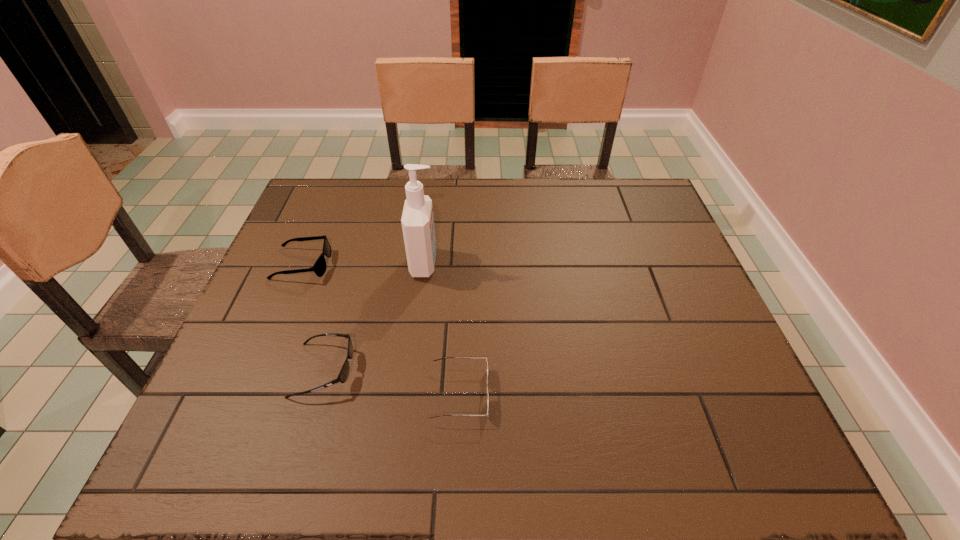
Identify which sunglasses is the second closest to the rightmost object. Please provide its 2D coordinates. Your answer should be formatted as a tuple, i.e. [(x, y)], where the tuple contains the x and y coordinates of a point satisfying the conditions above.

[(319, 268)]

Where is `sunglasses that is the nearest to the leftmost sunglasses`? sunglasses that is the nearest to the leftmost sunglasses is located at coordinates (343, 375).